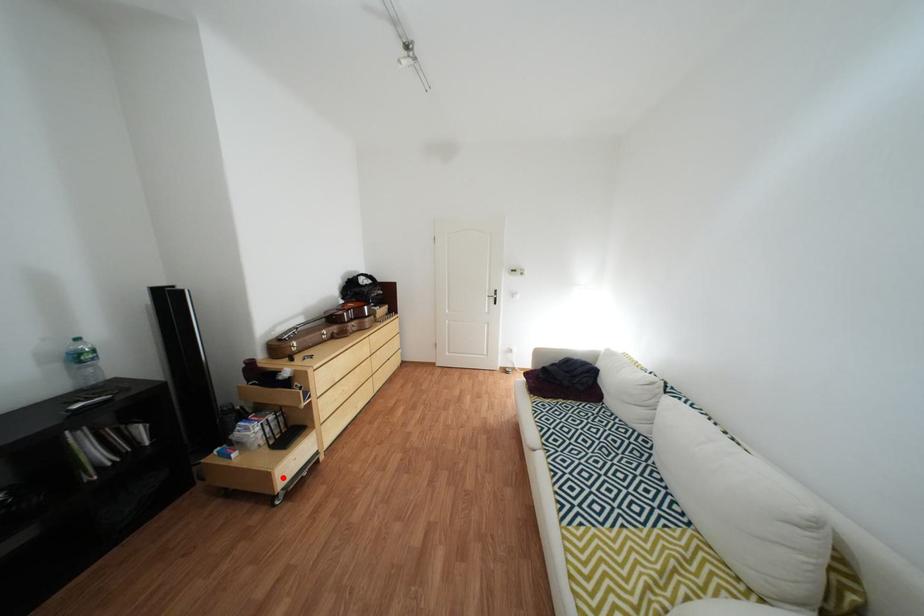
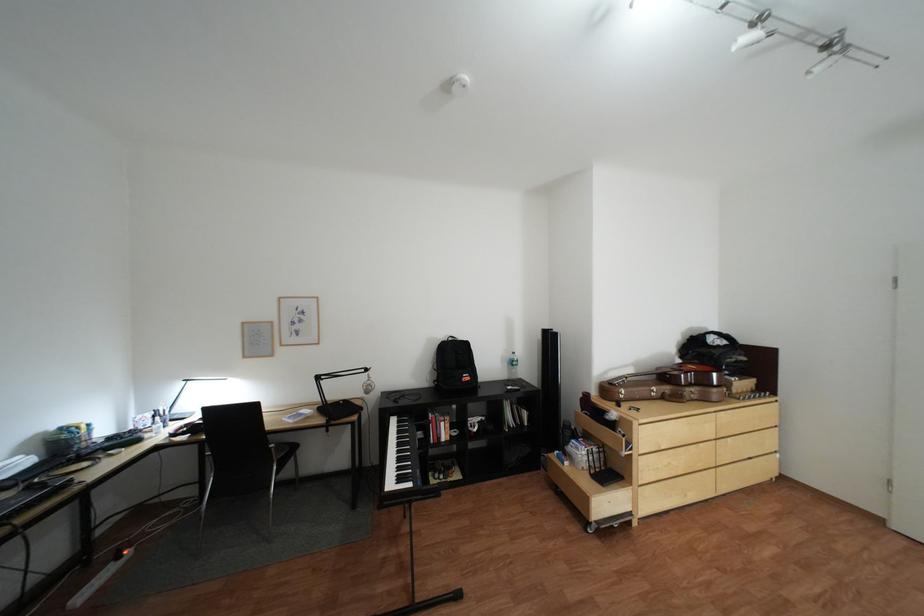
Question: I am providing you with two images of the same scene from different viewpoints. A red point is marked on the first image. Can you still see the location of the red point in image 2?

Choices:
 (A) Yes
 (B) No

Answer: (A)